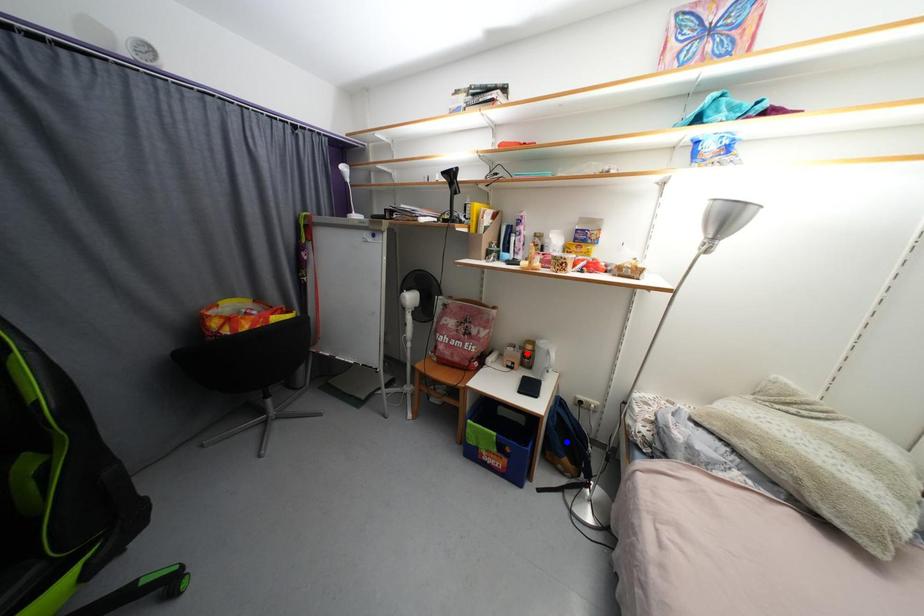
Question: Which of the two points in the image is closer to the camera?

Choices:
 (A) Blue point is closer.
 (B) Red point is closer.

Answer: (A)